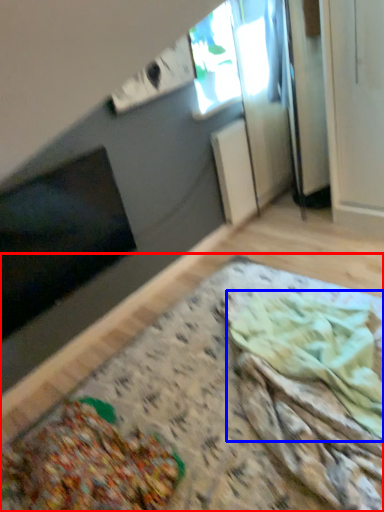
Question: Which of the following is the closest to the observer, table (highlighted by a red box) or food (highlighted by a blue box)?

Choices:
 (A) table
 (B) food

Answer: (A)